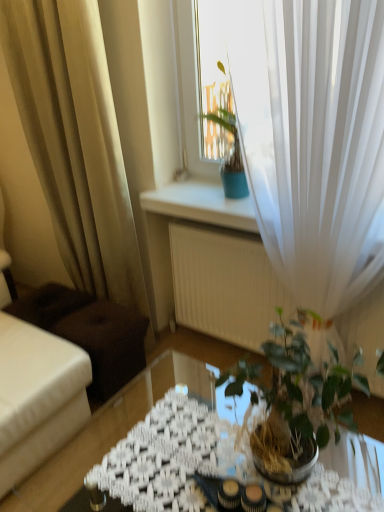
Question: From a real-world perspective, is translucent glass table at center beneath white sheer curtain at upper right, which is the 2th curtain from left to right?

Choices:
 (A) yes
 (B) no

Answer: (A)

Question: Is translucent glass table at center outside white sheer curtain at upper right, the 1th curtain positioned from the right?

Choices:
 (A) yes
 (B) no

Answer: (A)

Question: Is translucent glass table at center far away from white sheer curtain at upper right, which is the 2th curtain from left to right?

Choices:
 (A) no
 (B) yes

Answer: (B)

Question: From a real-world perspective, is translucent glass table at center on white sheer curtain at upper right, the 1th curtain positioned from the right?

Choices:
 (A) no
 (B) yes

Answer: (A)

Question: Is translucent glass table at center taller than white sheer curtain at upper right, the 1th curtain positioned from the right?

Choices:
 (A) yes
 (B) no

Answer: (B)

Question: From a real-world perspective, is beige sheer curtain at left, which is counted as the second curtain, starting from the right, above or below white sheer curtain at upper right, the 1th curtain positioned from the right?

Choices:
 (A) below
 (B) above

Answer: (A)

Question: Relative to white sheer curtain at upper right, the 1th curtain positioned from the right, is beige sheer curtain at left, arranged as the first curtain when viewed from the left, in front or behind?

Choices:
 (A) behind
 (B) front

Answer: (A)

Question: Do you think beige sheer curtain at left, arranged as the first curtain when viewed from the left, is within white sheer curtain at upper right, the 1th curtain positioned from the right, or outside of it?

Choices:
 (A) inside
 (B) outside

Answer: (B)

Question: Based on their sizes in the image, would you say beige sheer curtain at left, arranged as the first curtain when viewed from the left, is bigger or smaller than white sheer curtain at upper right, the 1th curtain positioned from the right?

Choices:
 (A) small
 (B) big

Answer: (A)

Question: Would you say translucent glass table at center is inside or outside green glossy houseplant at center?

Choices:
 (A) inside
 (B) outside

Answer: (B)

Question: In terms of height, does translucent glass table at center look taller or shorter compared to green glossy houseplant at center?

Choices:
 (A) short
 (B) tall

Answer: (B)

Question: In the image, is translucent glass table at center on the left side or the right side of green glossy houseplant at center?

Choices:
 (A) left
 (B) right

Answer: (A)

Question: Looking at their shapes, would you say translucent glass table at center is wider or thinner than green glossy houseplant at center?

Choices:
 (A) thin
 (B) wide

Answer: (B)

Question: Is beige sheer curtain at left, which is counted as the second curtain, starting from the right, taller or shorter than green glossy houseplant at center?

Choices:
 (A) tall
 (B) short

Answer: (A)

Question: Is point (96, 154) positioned closer to the camera than point (299, 365)?

Choices:
 (A) closer
 (B) farther

Answer: (B)